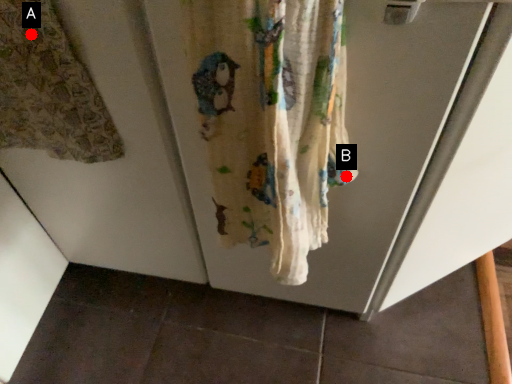
Question: Two points are circled on the image, labeled by A and B beside each circle. Which point appears farthest from the camera in this image?

Choices:
 (A) A is further
 (B) B is further

Answer: (B)